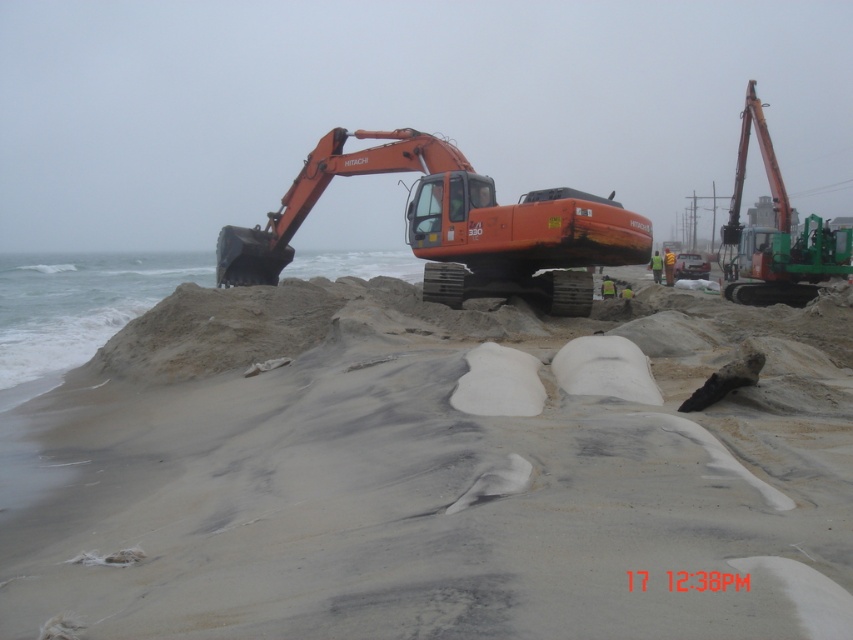
You are a construction worker on the beach. You need to place a temporary marker exactly between the smooth sand at center and the orange metallic excavator at right. Which object will the marker be closer to?

The smooth sand at center is smaller than the orange metallic excavator at right, so the marker will be closer to the smooth sand at center.

You are a construction worker needing to place a 3m wide equipment on the beach. You see the smooth sand at center and the orange metallic excavator at center. Which area can accommodate the equipment without it sinking?

The smooth sand at center is wider than the orange metallic excavator at center, so placing the 3m wide equipment on the smooth sand at center would be more stable and less likely to sink compared to the area near the excavator.